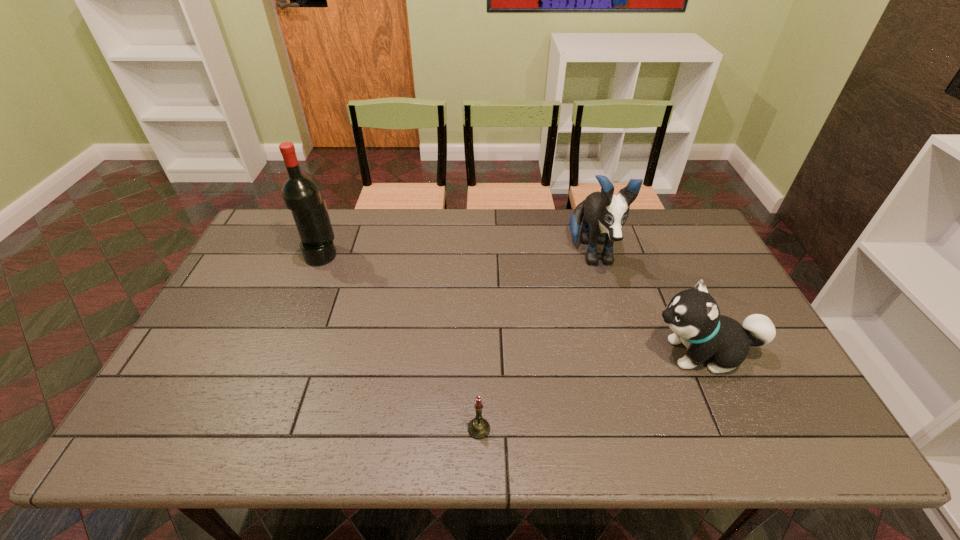
Identify the location of empty space that is in between the nearest object and the leftmost object. (400, 342).

The image size is (960, 540). In order to click on vacant area that lies between the wine bottle and the second object from left to right in this screenshot , I will do `click(400, 342)`.

Where is `free space between the wine bottle and the farther puppy`? The height and width of the screenshot is (540, 960). free space between the wine bottle and the farther puppy is located at coordinates (457, 254).

This screenshot has width=960, height=540. I want to click on vacant region between the candle and the right puppy, so click(590, 391).

Identify the location of vacant area that lies between the third object from left to right and the second nearest object. (647, 303).

This screenshot has height=540, width=960. I want to click on object that ranks as the closest to the second object from right to left, so click(x=693, y=315).

Identify which object is the third nearest to the second object from right to left. Please provide its 2D coordinates. Your answer should be formatted as a tuple, i.e. [(x, y)], where the tuple contains the x and y coordinates of a point satisfying the conditions above.

[(301, 195)]

Identify the location of free space that satisfies the following two spatial constraints: 1. on the front side of the wine bottle; 2. on the left side of the shortest object. The image size is (960, 540). (251, 429).